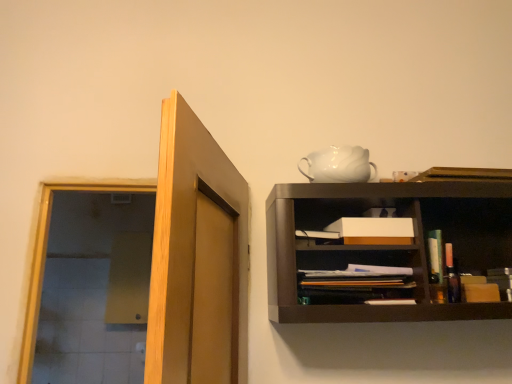
Question: In terms of width, does white glossy teapot at upper center look wider or thinner when compared to light brown wood door at upper left?

Choices:
 (A) wide
 (B) thin

Answer: (B)

Question: Relative to light brown wood door at upper left, is white glossy teapot at upper center in front or behind?

Choices:
 (A) behind
 (B) front

Answer: (A)

Question: Which object is the closest to the white matte box at center?

Choices:
 (A) light brown wood door at upper left
 (B) white glossy teapot at upper center
 (C) matte black book at center

Answer: (C)

Question: Which of these objects is positioned closest to the white matte box at center?

Choices:
 (A) white glossy teapot at upper center
 (B) matte black book at center
 (C) light brown wood door at upper left

Answer: (B)